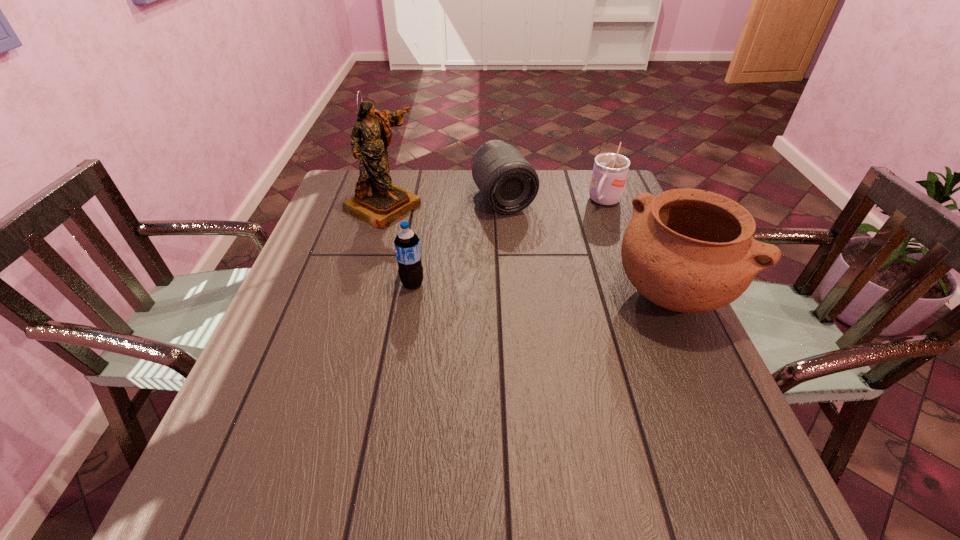
The image size is (960, 540). I want to click on pottery located in the right edge section of the desktop, so click(x=687, y=250).

Locate an element on the screen. cup that is at the right edge is located at coordinates (610, 170).

Image resolution: width=960 pixels, height=540 pixels. Find the location of `object at the far left corner`. object at the far left corner is located at coordinates (377, 201).

Locate an element on the screen. object at the far right corner is located at coordinates (610, 170).

In the image, there is a desktop. At what (x,y) coordinates should I click in order to perform the action: click on free space at the far edge. Please return your answer as a coordinate pair (x, y). Looking at the image, I should click on (455, 200).

The height and width of the screenshot is (540, 960). Identify the location of free point at the left edge. (279, 328).

Locate an element on the screen. Image resolution: width=960 pixels, height=540 pixels. blank space at the right edge of the desktop is located at coordinates (689, 343).

At what (x,y) coordinates should I click in order to perform the action: click on vacant region at the near left corner. Please return your answer as a coordinate pair (x, y). The height and width of the screenshot is (540, 960). Looking at the image, I should click on (306, 415).

Locate an element on the screen. The width and height of the screenshot is (960, 540). vacant space at the near right corner of the desktop is located at coordinates (652, 412).

This screenshot has width=960, height=540. Identify the location of free space between the cup and the soda bottle. (509, 243).